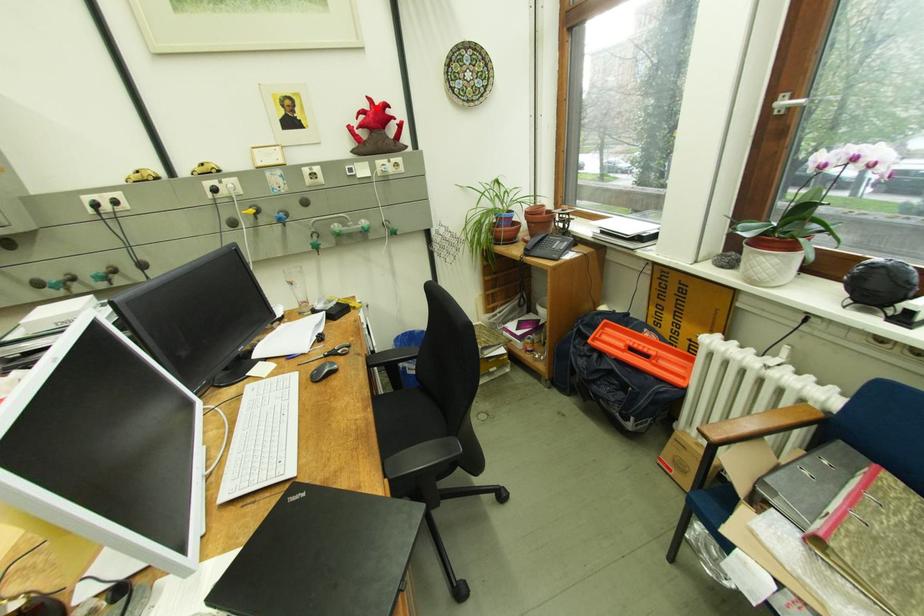
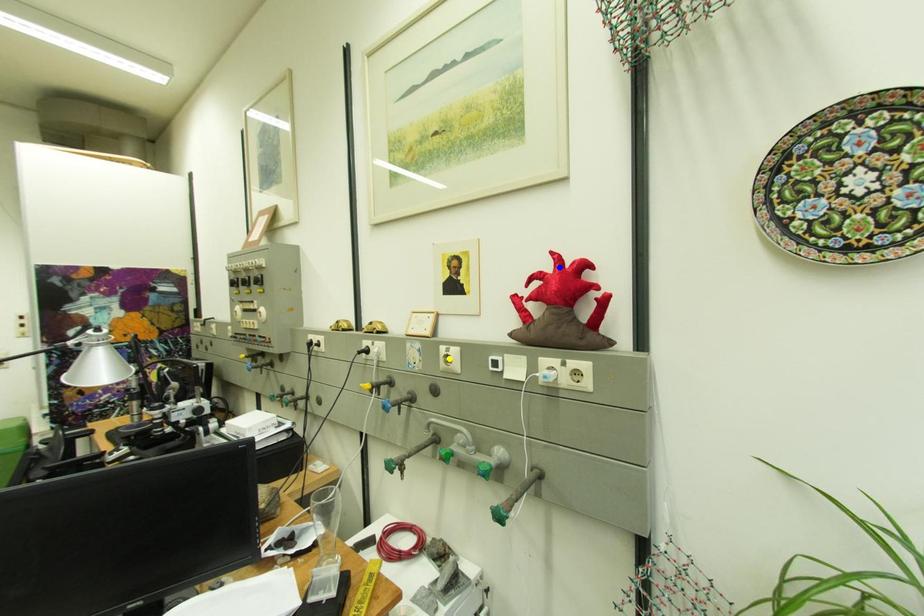
Question: I am providing you with two images of the same scene from different viewpoints. A red point is marked on the first image. You are given multiple points on the second image. Which mark in image 2 goes with the point in image 1?

Choices:
 (A) green point
 (B) yellow point
 (C) blue point

Answer: (C)